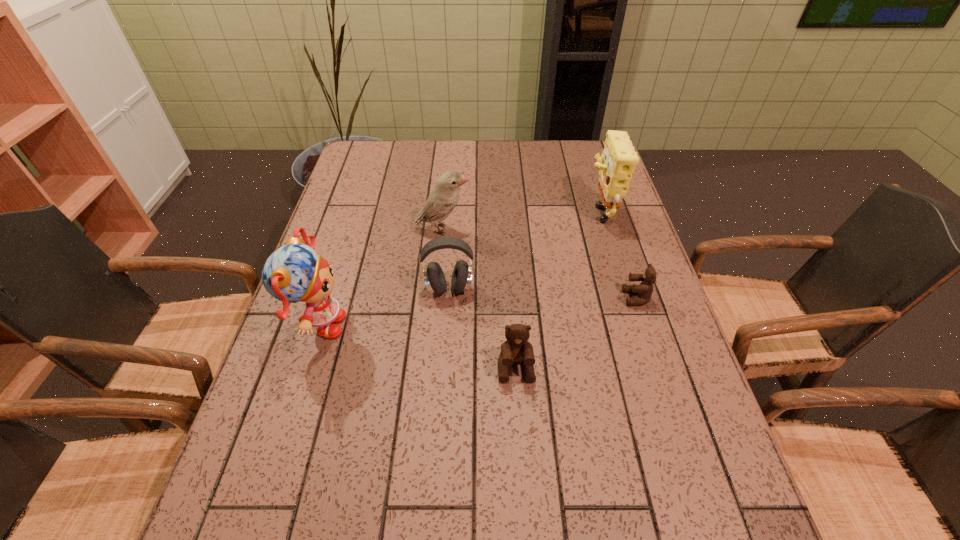
The width and height of the screenshot is (960, 540). I want to click on the fourth object from left to right, so click(x=516, y=349).

This screenshot has height=540, width=960. Find the location of `the second shortest object`. the second shortest object is located at coordinates (516, 349).

Locate an element on the screen. the shorter teddy bear is located at coordinates (645, 289).

The height and width of the screenshot is (540, 960). I want to click on the right teddy bear, so click(x=645, y=289).

The width and height of the screenshot is (960, 540). I want to click on bird, so click(x=443, y=199).

This screenshot has width=960, height=540. What are the coordinates of `sponge` in the screenshot? It's located at (619, 159).

Identify the location of headset. This screenshot has height=540, width=960. (434, 278).

You are a GUI agent. You are given a task and a screenshot of the screen. Output one action in this format:
    pyautogui.click(x=<x>, y=<y>)
    Task: Click on the doll
    This screenshot has height=540, width=960.
    Given the screenshot: What is the action you would take?
    pyautogui.click(x=293, y=273)

Identify the location of vacant space located 0.140m on the face of the third object from right to left. (521, 449).

This screenshot has width=960, height=540. I want to click on vacant space situated 0.390m on the face of the shorter teddy bear, so click(468, 298).